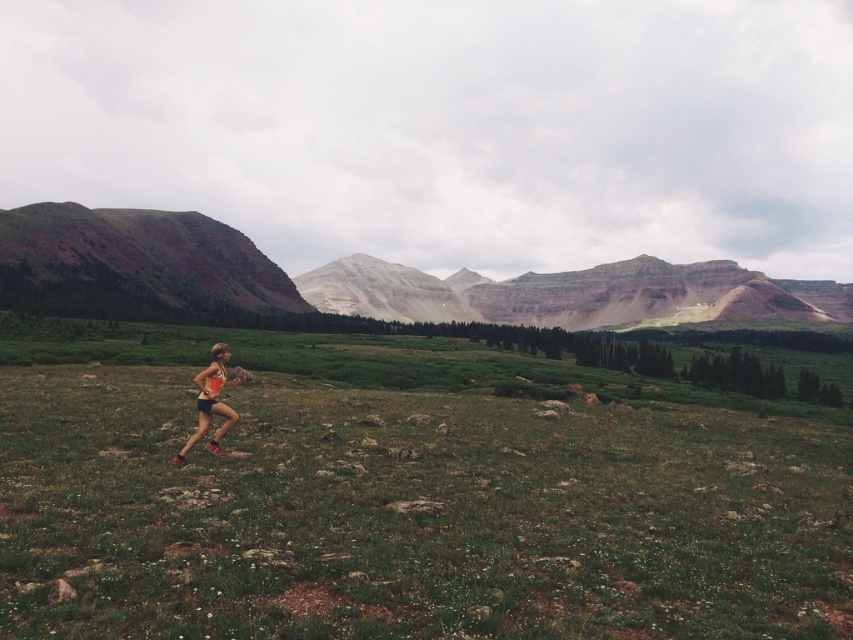
Question: Which of the following is the farthest from the observer?

Choices:
 (A) (666, 321)
 (B) (148, 339)
 (C) (230, 300)
 (D) (204, 392)

Answer: (A)

Question: Which of the following is the closest to the observer?

Choices:
 (A) orange fabric running suit at center
 (B) rustic rock hillside at left

Answer: (A)

Question: From the image, what is the correct spatial relationship of green grassy field at center in relation to rustic rock hillside at left?

Choices:
 (A) right
 (B) left

Answer: (A)

Question: Observing the image, what is the correct spatial positioning of green grassy field at center in reference to orange fabric running suit at center?

Choices:
 (A) above
 (B) below

Answer: (B)

Question: Which object appears closest to the camera in this image?

Choices:
 (A) green grassy field at center
 (B) orange fabric running suit at center
 (C) rustic rock hillside at left
 (D) rustic brown cliff at left

Answer: (A)

Question: Does green grassy field at center have a larger size compared to rustic brown cliff at left?

Choices:
 (A) no
 (B) yes

Answer: (A)